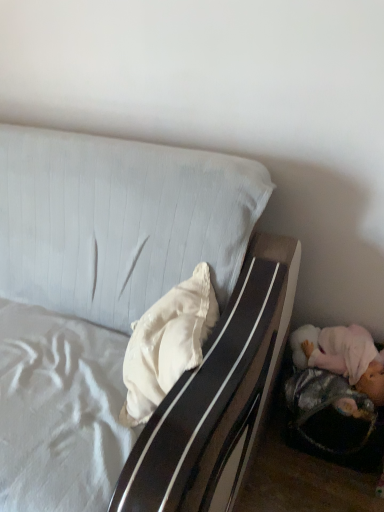
Find the location of a particular element. white satin pillow at center is located at coordinates (167, 344).

The image size is (384, 512). What do you see at coordinates (167, 344) in the screenshot?
I see `white satin pillow at center` at bounding box center [167, 344].

What are the coordinates of `white fabric bed at upper left` in the screenshot? It's located at (115, 298).

The height and width of the screenshot is (512, 384). What do you see at coordinates (115, 298) in the screenshot? I see `white fabric bed at upper left` at bounding box center [115, 298].

At what (x,y) coordinates should I click in order to perform the action: click on white satin pillow at center. Please return your answer as a coordinate pair (x, y). The width and height of the screenshot is (384, 512). Looking at the image, I should click on (167, 344).

Is white satin pillow at center at the right side of white fabric bed at upper left?

Yes, white satin pillow at center is to the right of white fabric bed at upper left.

Which object is closer to the camera taking this photo, white satin pillow at center or white fabric bed at upper left?

white fabric bed at upper left is more forward.

Considering the points (130, 407) and (29, 265), which point is in front, point (130, 407) or point (29, 265)?

The point (130, 407) is closer.

From the image's perspective, would you say white satin pillow at center is shown under white fabric bed at upper left?

Yes, from the image's perspective, white satin pillow at center is beneath white fabric bed at upper left.

From a real-world perspective, is white satin pillow at center physically above white fabric bed at upper left?

Yes.

Considering the sizes of objects white satin pillow at center and white fabric bed at upper left in the image provided, who is thinner, white satin pillow at center or white fabric bed at upper left?

With smaller width is white satin pillow at center.

Does white satin pillow at center have a lesser height compared to white fabric bed at upper left?

Yes, white satin pillow at center is shorter than white fabric bed at upper left.

Consider the image. Is white satin pillow at center smaller than white fabric bed at upper left?

Yes.

Would you say white fabric bed at upper left is part of white satin pillow at center's contents?

No, white fabric bed at upper left is not surrounded by white satin pillow at center.

Is white satin pillow at center not near white fabric bed at upper left?

white satin pillow at center is actually quite close to white fabric bed at upper left.

Could you tell me if white satin pillow at center is turned towards white fabric bed at upper left?

Yes, white satin pillow at center is oriented towards white fabric bed at upper left.

How far apart are white satin pillow at center and white fabric bed at upper left?

A distance of 8.06 inches exists between white satin pillow at center and white fabric bed at upper left.

Where is `bed above the white satin pillow at center (from the image's perspective)`? bed above the white satin pillow at center (from the image's perspective) is located at coordinates (115, 298).

Considering the positions of objects white fabric bed at upper left and white satin pillow at center in the image provided, who is more to the right, white fabric bed at upper left or white satin pillow at center?

Positioned to the right is white satin pillow at center.

Which object is more forward, white fabric bed at upper left or white satin pillow at center?

white fabric bed at upper left is closer to the camera.

Considering the points (122, 466) and (140, 376), which point is in front, point (122, 466) or point (140, 376)?

Point (122, 466)

From the image's perspective, does white fabric bed at upper left appear higher than white satin pillow at center?

Yes.

Consider the image. From a real-world perspective, does white fabric bed at upper left sit lower than white satin pillow at center?

Yes.

Is white fabric bed at upper left wider or thinner than white satin pillow at center?

white fabric bed at upper left is wider than white satin pillow at center.

Considering the sizes of objects white fabric bed at upper left and white satin pillow at center in the image provided, who is shorter, white fabric bed at upper left or white satin pillow at center?

With less height is white satin pillow at center.

In terms of size, does white fabric bed at upper left appear bigger or smaller than white satin pillow at center?

In the image, white fabric bed at upper left appears to be larger than white satin pillow at center.

Is white satin pillow at center inside white fabric bed at upper left?

Yes, white satin pillow at center is surrounded by white fabric bed at upper left.

Is white fabric bed at upper left far from white satin pillow at center?

No, there isn't a large distance between white fabric bed at upper left and white satin pillow at center.

Is white fabric bed at upper left oriented towards white satin pillow at center?

No, white fabric bed at upper left is not aimed at white satin pillow at center.

Based on the photo, how many degrees apart are the facing directions of white fabric bed at upper left and white satin pillow at center?

→ There is a 59-degree angle between the facing directions of white fabric bed at upper left and white satin pillow at center.

Where is `bed that appears in front of the white satin pillow at center`? The height and width of the screenshot is (512, 384). bed that appears in front of the white satin pillow at center is located at coordinates (115, 298).

The width and height of the screenshot is (384, 512). I want to click on pillow behind the white fabric bed at upper left, so click(167, 344).

Locate an element on the screen. bed above the white satin pillow at center (from the image's perspective) is located at coordinates (115, 298).